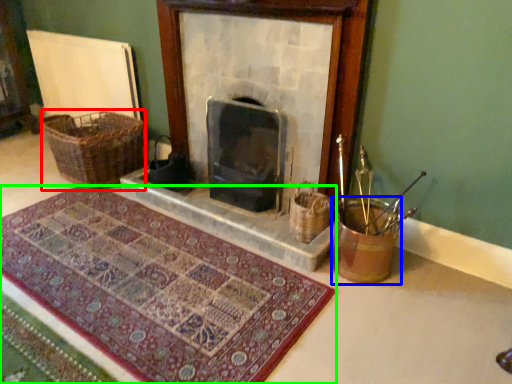
Question: Considering the real-world distances, which object is farthest from basket (highlighted by a red box)? basket container (highlighted by a blue box) or mat (highlighted by a green box)?

Choices:
 (A) basket container
 (B) mat

Answer: (A)